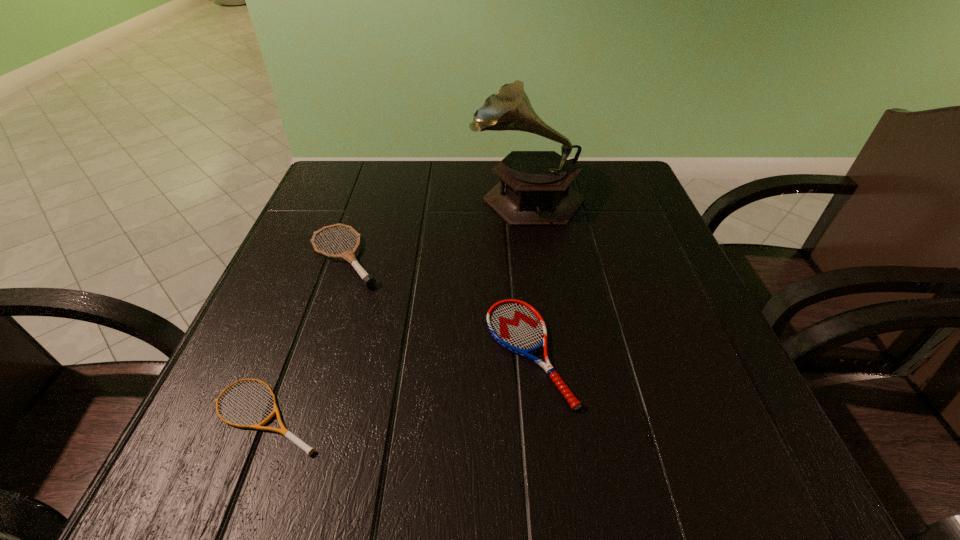
This screenshot has height=540, width=960. What are the coordinates of `vacant area at the far left corner of the desktop` in the screenshot? It's located at (345, 167).

At what (x,y) coordinates should I click in order to perform the action: click on vacant region at the near left corner of the desktop. Please return your answer as a coordinate pair (x, y). Looking at the image, I should click on (295, 430).

Where is `free location at the far right corner of the desktop`? free location at the far right corner of the desktop is located at coordinates (645, 204).

Identify the location of free space between the farthest tennis racket and the third tallest object. (437, 305).

Identify the location of free space between the shortest object and the tallest object. (396, 304).

Locate an element on the screen. The width and height of the screenshot is (960, 540). free space between the second farthest object and the third tallest object is located at coordinates pos(437,305).

Find the location of a particular element. Image resolution: width=960 pixels, height=540 pixels. vacant space that is in between the farthest tennis racket and the rightmost tennis racket is located at coordinates (437, 305).

Where is `vacant area that lies between the second farthest object and the phonograph record`? This screenshot has height=540, width=960. vacant area that lies between the second farthest object and the phonograph record is located at coordinates (436, 226).

Where is `free point between the shortest object and the farthest object`? Image resolution: width=960 pixels, height=540 pixels. free point between the shortest object and the farthest object is located at coordinates (396, 304).

Where is `free space between the second shortest object and the third nearest object`? This screenshot has height=540, width=960. free space between the second shortest object and the third nearest object is located at coordinates (437, 305).